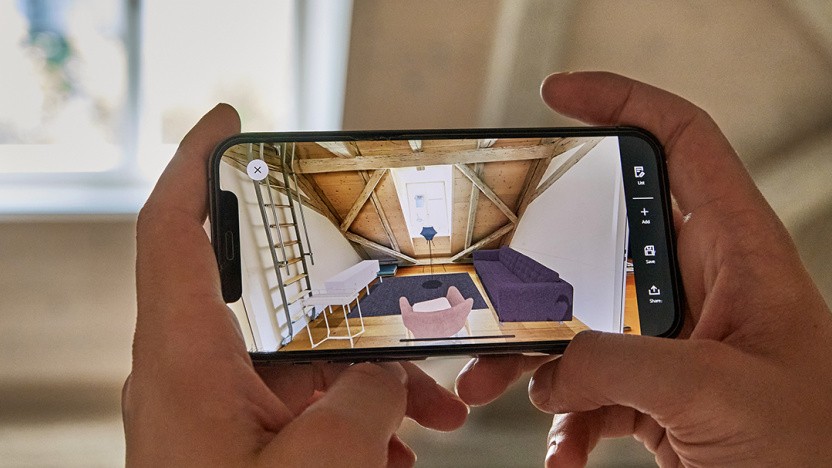
Find the location of a particular element. Image resolution: width=832 pixels, height=468 pixels. wall is located at coordinates (56, 308), (712, 46), (463, 45).